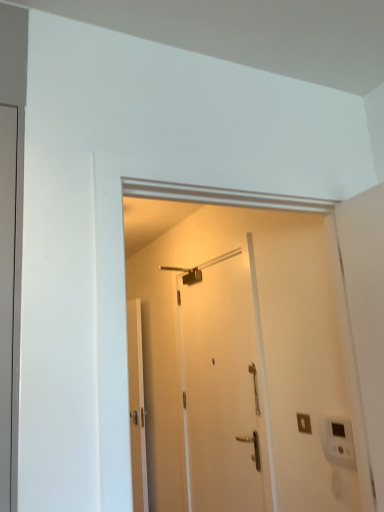
Question: Is matte gray door at left, the first door viewed from the front, in front of or behind white matte door at center, the third door viewed from the left, in the image?

Choices:
 (A) behind
 (B) front

Answer: (B)

Question: From the image's perspective, is matte gray door at left, arranged as the 1th door when viewed from the left, positioned above or below white matte door at center, the 2th door in the front-to-back sequence?

Choices:
 (A) above
 (B) below

Answer: (A)

Question: Estimate the real-world distances between objects in this image. Which object is closer to the white matte door at center, which is the 2th door from back to front?

Choices:
 (A) matte gray door at left, arranged as the 1th door when viewed from the left
 (B) white glossy door at center, arranged as the second door when viewed from the left
 (C) metallic silver shower at upper center

Answer: (C)

Question: Which is farther from the white glossy door at center, arranged as the second door when viewed from the left?

Choices:
 (A) white matte door at center, the third door viewed from the left
 (B) matte gray door at left, arranged as the 1th door when viewed from the left
 (C) metallic silver shower at upper center

Answer: (B)